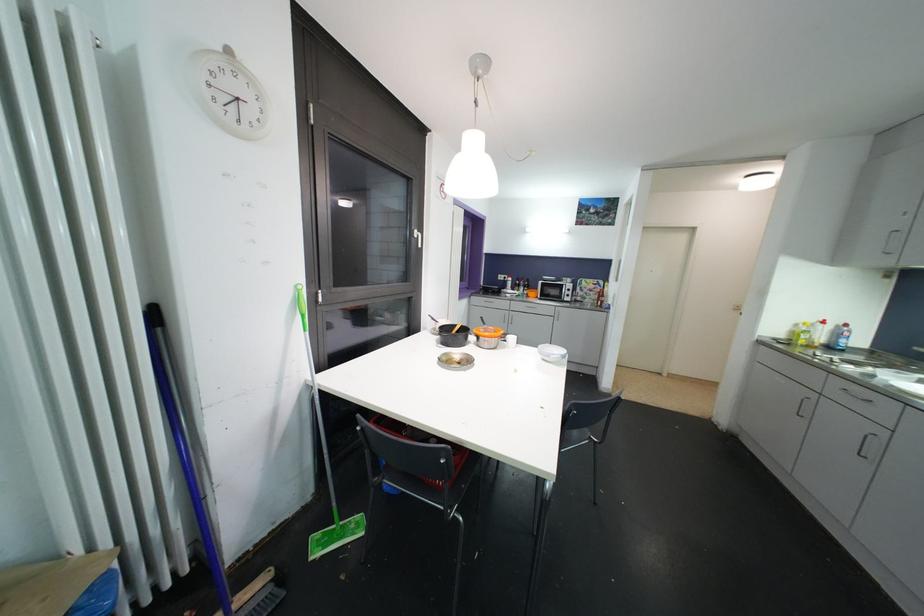
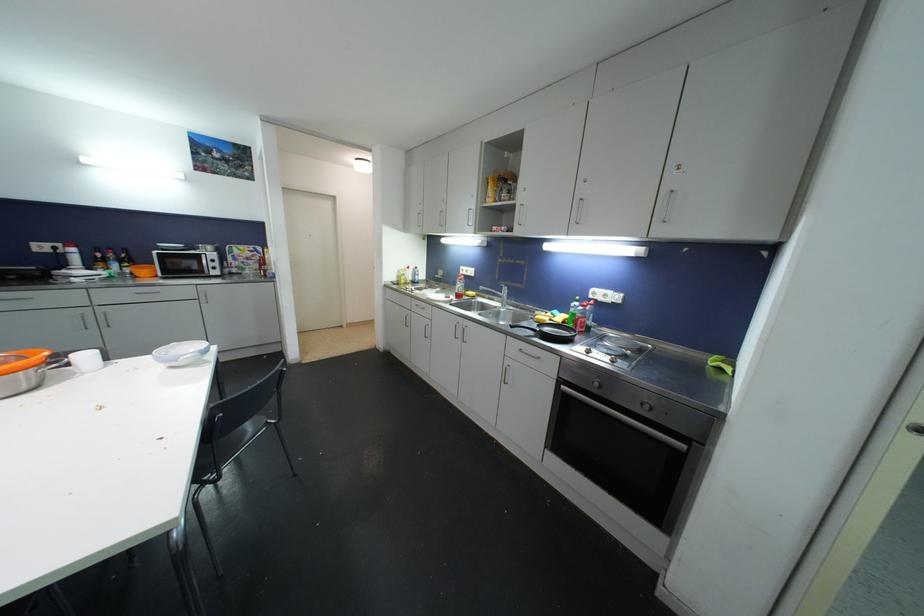
Find the pixel in the second image that matches point 515,341 in the first image.

(89, 360)